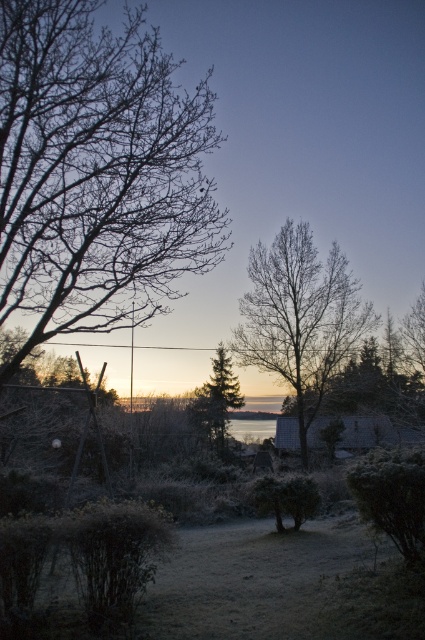
You are an artist preparing to sketch this winter scene. You need to decide which area to focus on first based on the visual impact of the branches. Which set of branches, the bare branches at left or the bare branches at center, should you draw first if you want to emphasize the wider ones?

The bare branches at left should be drawn first because their width surpasses that of the bare branches at center, making them more visually prominent.

You are an artist planning to paint this winter scene. You want to ensure the bare branches at left and the green textured pine tree at center are proportionate. Which object should you make wider in your painting?

The bare branches at left should be made wider in the painting since they might be wider than the green textured pine tree at center according to the description.

You are standing in the winter scene and want to walk from the point at coordinates (95, 305) to the point at (334, 269). Which direction should you move to get closer to your destination?

To move from point (95, 305) to point (334, 269), you should move upward because point (334, 269) is further away from the camera compared to point (95, 305).